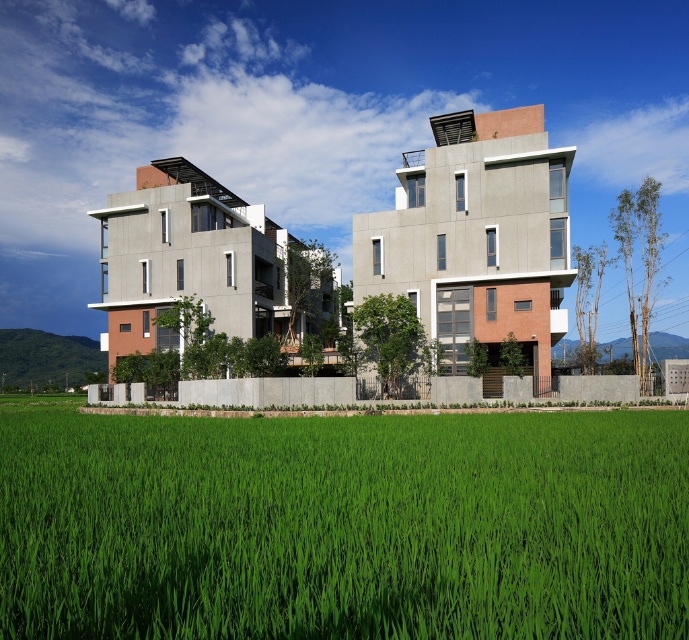
Does green grass at lower center have a greater height compared to green grassy hillside at center?

No.

Between green grass at lower center and green grassy hillside at center, which one has less height?

green grass at lower center

Identify the location of green grass at lower center. (342, 525).